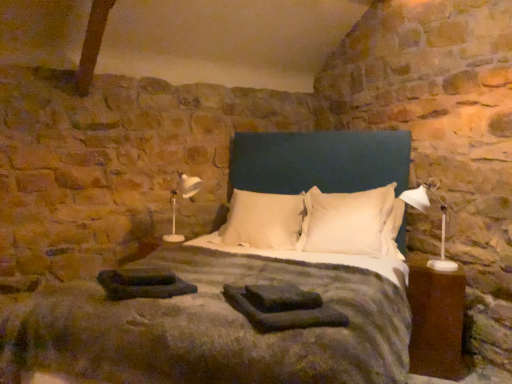
Question: In which direction should I rotate to look at dark gray fabric at center, arranged as the 1th material when viewed from the right?

Choices:
 (A) left
 (B) right

Answer: (B)

Question: Is black fabric at lower left, placed as the 2th material when sorted from right to left, a part of velvet blue bed at center?

Choices:
 (A) no
 (B) yes

Answer: (B)

Question: Is the depth of velvet blue bed at center greater than that of black fabric at lower left, the 1th material when ordered from left to right?

Choices:
 (A) no
 (B) yes

Answer: (A)

Question: Is velvet blue bed at center bigger than black fabric at lower left, placed as the 2th material when sorted from right to left?

Choices:
 (A) no
 (B) yes

Answer: (B)

Question: Considering the relative sizes of velvet blue bed at center and black fabric at lower left, the 1th material when ordered from left to right, in the image provided, is velvet blue bed at center shorter than black fabric at lower left, the 1th material when ordered from left to right,?

Choices:
 (A) no
 (B) yes

Answer: (A)

Question: Is velvet blue bed at center positioned with its back to black fabric at lower left, the 1th material when ordered from left to right?

Choices:
 (A) no
 (B) yes

Answer: (A)

Question: Considering the relative sizes of velvet blue bed at center and black fabric at lower left, placed as the 2th material when sorted from right to left, in the image provided, is velvet blue bed at center smaller than black fabric at lower left, placed as the 2th material when sorted from right to left,?

Choices:
 (A) no
 (B) yes

Answer: (A)

Question: Can you confirm if velvet blue bed at center is positioned to the right of white soft pillow at center, which appears as the 1th pillow when viewed from the left?

Choices:
 (A) no
 (B) yes

Answer: (B)

Question: Is white soft pillow at center, which appears as the 1th pillow when viewed from the left, located within velvet blue bed at center?

Choices:
 (A) no
 (B) yes

Answer: (B)

Question: From the image's perspective, is velvet blue bed at center on top of white soft pillow at center, which is the second pillow from right to left?

Choices:
 (A) yes
 (B) no

Answer: (B)

Question: Considering the relative sizes of velvet blue bed at center and white soft pillow at center, which appears as the 1th pillow when viewed from the left, in the image provided, is velvet blue bed at center bigger than white soft pillow at center, which appears as the 1th pillow when viewed from the left,?

Choices:
 (A) no
 (B) yes

Answer: (B)

Question: Is the position of velvet blue bed at center more distant than that of white soft pillow at center, which is the second pillow from right to left?

Choices:
 (A) yes
 (B) no

Answer: (B)

Question: Is velvet blue bed at center located outside white soft pillow at center, which is the second pillow from right to left?

Choices:
 (A) yes
 (B) no

Answer: (A)

Question: From a real-world perspective, is brown wood nightstand at right positioned under dark gray fabric at center, arranged as the 1th material when viewed from the right, based on gravity?

Choices:
 (A) yes
 (B) no

Answer: (A)